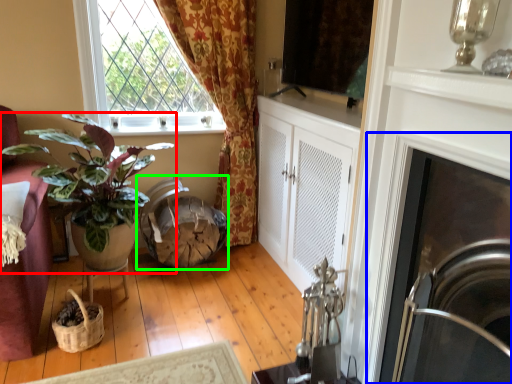
Question: Which is farther away from houseplant (highlighted by a red box)? fireplace (highlighted by a blue box) or swivel chair (highlighted by a green box)?

Choices:
 (A) fireplace
 (B) swivel chair

Answer: (A)